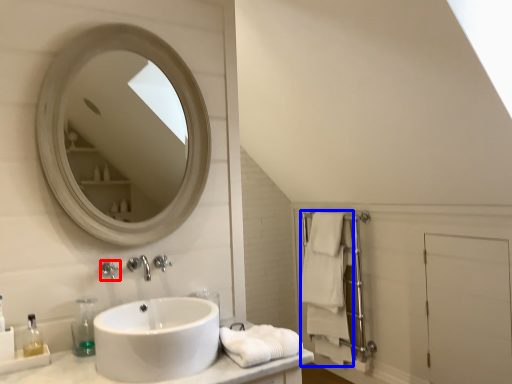
Question: Among these objects, which one is nearest to the camera, faucet (highlighted by a red box) or bath towel (highlighted by a blue box)?

Choices:
 (A) faucet
 (B) bath towel

Answer: (A)